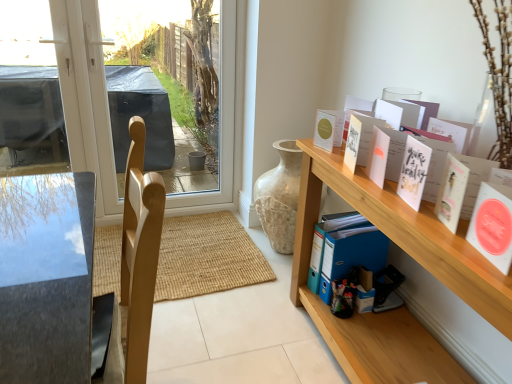
Question: Considering the relative sizes of white matte cards at upper right, positioned as the fourth book in back-to-front order, and wooden shelf at right in the image provided, is white matte cards at upper right, positioned as the fourth book in back-to-front order, taller than wooden shelf at right?

Choices:
 (A) no
 (B) yes

Answer: (A)

Question: Does white matte cards at upper right, which is the first book in front-to-back order, turn towards wooden shelf at right?

Choices:
 (A) no
 (B) yes

Answer: (A)

Question: Is white matte cards at upper right, which is the first book in front-to-back order, thinner than wooden shelf at right?

Choices:
 (A) no
 (B) yes

Answer: (A)

Question: Are white matte cards at upper right, which is the first book in front-to-back order, and wooden shelf at right making contact?

Choices:
 (A) no
 (B) yes

Answer: (A)

Question: Is white matte cards at upper right, which is the first book in front-to-back order, shorter than wooden shelf at right?

Choices:
 (A) yes
 (B) no

Answer: (A)

Question: From their relative heights in the image, would you say transparent glass window at upper left is taller or shorter than wooden shelf at right?

Choices:
 (A) short
 (B) tall

Answer: (B)

Question: Would you say transparent glass window at upper left is to the left or to the right of wooden shelf at right in the picture?

Choices:
 (A) left
 (B) right

Answer: (A)

Question: Is transparent glass window at upper left situated inside wooden shelf at right or outside?

Choices:
 (A) outside
 (B) inside

Answer: (A)

Question: Based on their sizes in the image, would you say transparent glass window at upper left is bigger or smaller than wooden shelf at right?

Choices:
 (A) big
 (B) small

Answer: (B)

Question: Choose the correct answer: Is wooden shelf at right inside matte white card at upper right, the fourth book in the front-to-back sequence, or outside it?

Choices:
 (A) inside
 (B) outside

Answer: (B)

Question: Considering the relative positions of wooden shelf at right and matte white card at upper right, which is the 1th book from back to front, in the image provided, is wooden shelf at right to the left or to the right of matte white card at upper right, which is the 1th book from back to front,?

Choices:
 (A) left
 (B) right

Answer: (B)

Question: Looking at their shapes, would you say wooden shelf at right is wider or thinner than matte white card at upper right, which is the 1th book from back to front?

Choices:
 (A) thin
 (B) wide

Answer: (B)

Question: Is wooden shelf at right in front of or behind matte white card at upper right, the fourth book in the front-to-back sequence, in the image?

Choices:
 (A) front
 (B) behind

Answer: (A)

Question: Looking at their shapes, would you say matte white card at upper right, which is the 1th book from back to front, is wider or thinner than white paper card at upper right, the second book when ordered from back to front?

Choices:
 (A) wide
 (B) thin

Answer: (A)

Question: Is matte white card at upper right, which is the 1th book from back to front, spatially inside white paper card at upper right, arranged as the 3th book when viewed from the front, or outside of it?

Choices:
 (A) outside
 (B) inside

Answer: (A)